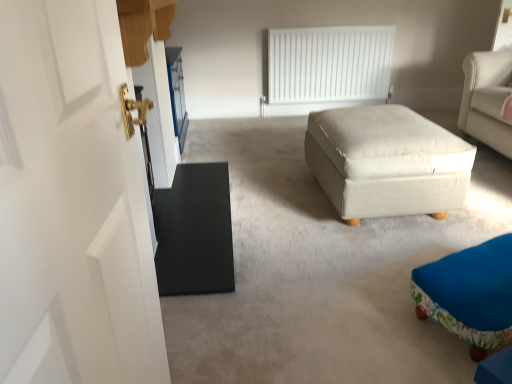
Locate an element on the screen. This screenshot has height=384, width=512. free space that is in between floral fabric ottoman at lower right and black matte table at left, the 2th table when ordered from right to left is located at coordinates (309, 247).